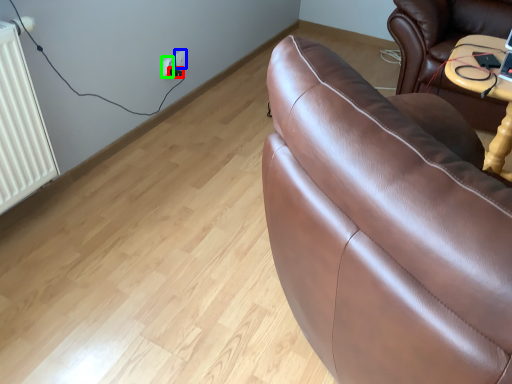
Question: Considering the real-world distances, which object is closest to plug (highlighted by a red box)? electric outlet (highlighted by a blue box) or electric outlet (highlighted by a green box).

Choices:
 (A) electric outlet
 (B) electric outlet

Answer: (A)